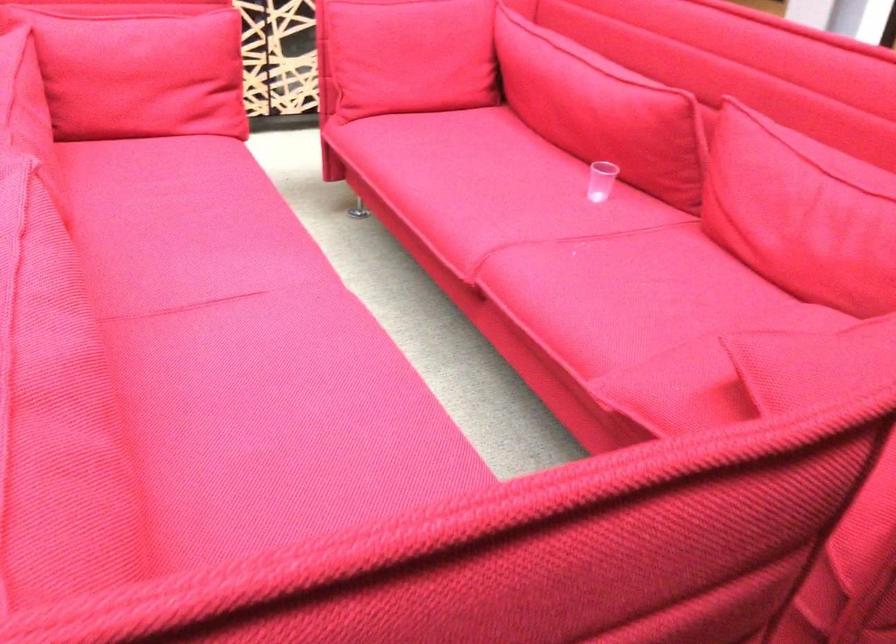
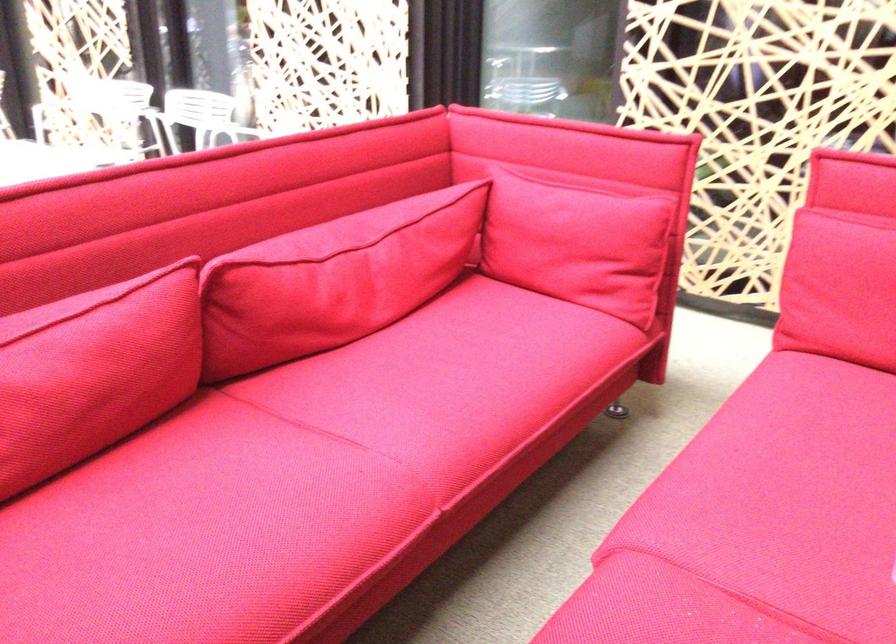
Locate, in the second image, the point that corresponds to pixel 286 328 in the first image.

(298, 476)